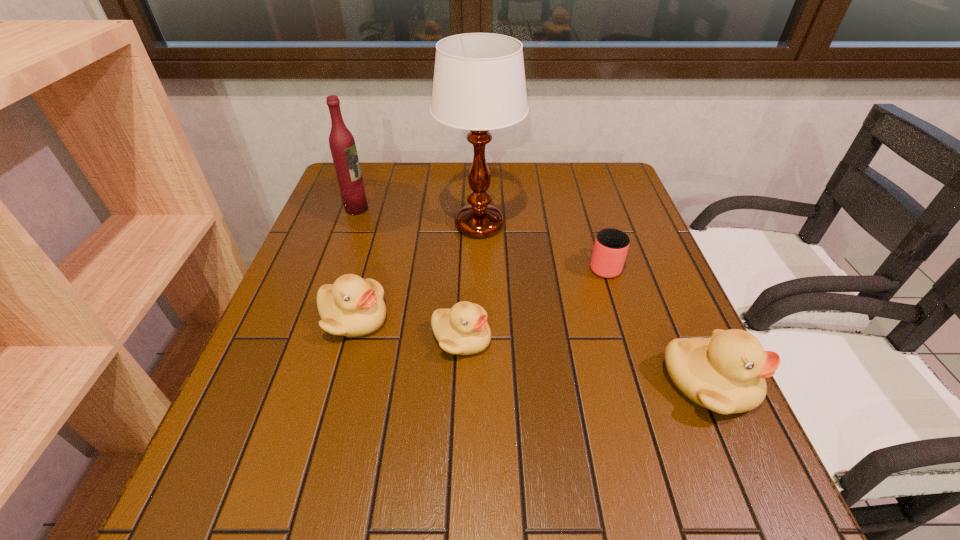
Identify the location of the third shortest object. (352, 306).

Find the location of `the leftmost duckling`. the leftmost duckling is located at coordinates (352, 306).

This screenshot has height=540, width=960. What are the coordinates of `the second duckling from right to left` in the screenshot? It's located at point(463,330).

Locate an element on the screen. This screenshot has height=540, width=960. the rightmost object is located at coordinates (725, 373).

Identify the location of liquor. (342, 144).

The image size is (960, 540). I want to click on the tallest object, so click(x=479, y=84).

Locate an element on the screen. This screenshot has height=540, width=960. cup is located at coordinates (611, 245).

Image resolution: width=960 pixels, height=540 pixels. I want to click on vacant space situated 0.200m on the beak of the second shortest duckling, so click(480, 319).

What are the coordinates of `vacant region located on the beak of the second duckling from right to left` in the screenshot? It's located at (567, 339).

You are a GUI agent. You are given a task and a screenshot of the screen. Output one action in this format:
    pyautogui.click(x=<x>, y=<y>)
    Task: Click on the vacant area situated 0.150m on the label of the second tallest object
    This screenshot has width=960, height=540.
    Given the screenshot: What is the action you would take?
    pyautogui.click(x=420, y=209)